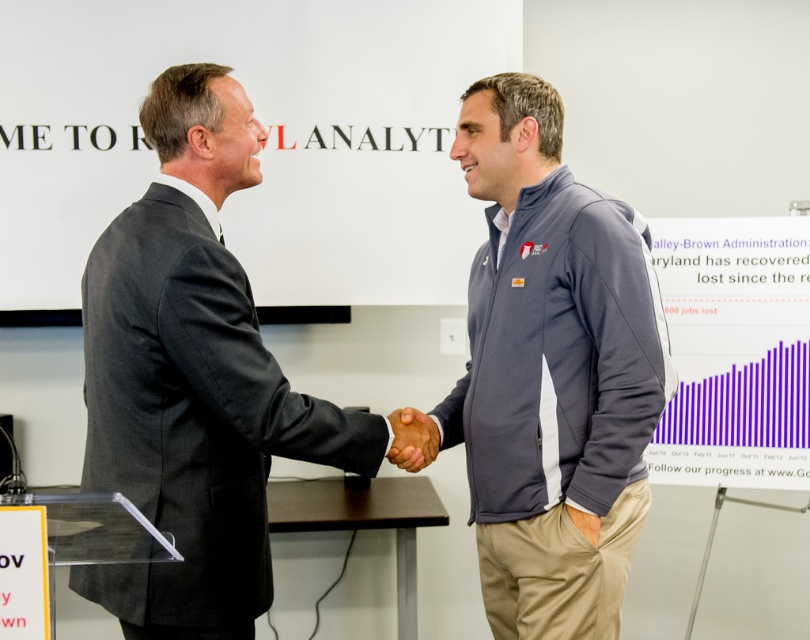
Question: Is gray fleece jacket at center wider than brown leather hand at center?

Choices:
 (A) yes
 (B) no

Answer: (A)

Question: Which point is farther from the camera taking this photo?

Choices:
 (A) (536, 433)
 (B) (201, 417)

Answer: (A)

Question: Which is farther from the gray fleece jacket at center?

Choices:
 (A) brown leather hand at center
 (B) dark gray suit at center

Answer: (B)

Question: Is dark gray suit at center wider than brown leather hand at center?

Choices:
 (A) yes
 (B) no

Answer: (A)

Question: Among these objects, which one is nearest to the camera?

Choices:
 (A) dark gray suit at center
 (B) brown leather hand at center
 (C) gray fleece jacket at center

Answer: (A)

Question: Is dark gray suit at center thinner than brown leather hand at center?

Choices:
 (A) no
 (B) yes

Answer: (A)